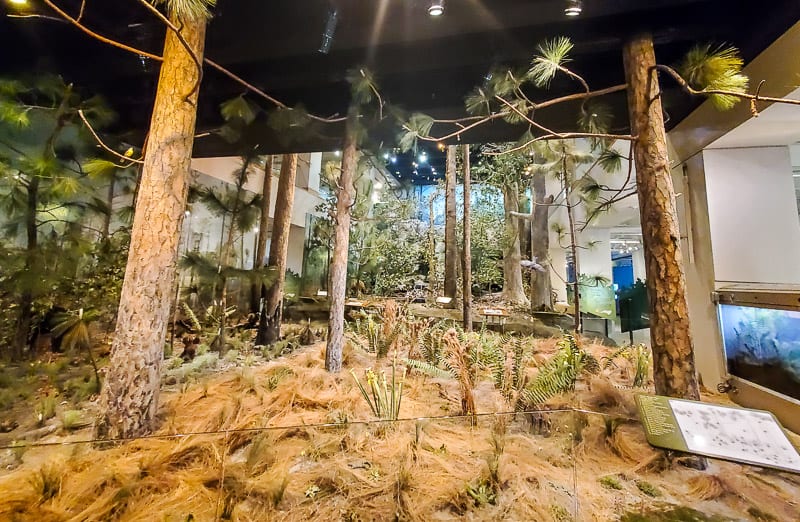
Where is `walls`? walls is located at coordinates [222, 165].